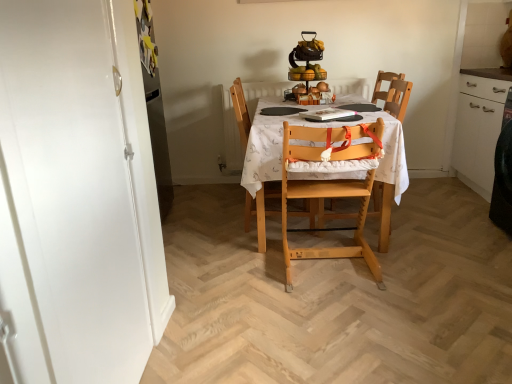
Locate an element on the screen. free spot in front of wooden chair with cushion at center, acting as the third chair starting from the right is located at coordinates (257, 250).